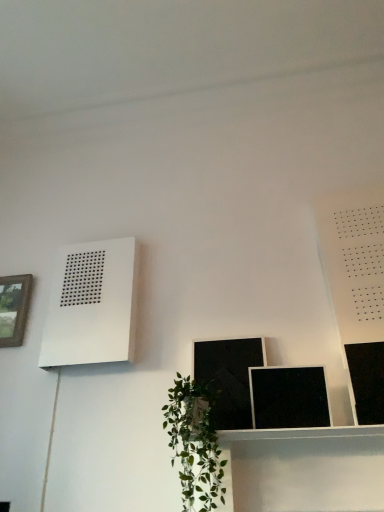
Question: Does black matte picture frame at lower center, which is counted as the 3th picture frame, starting from the left, lie in front of white matte air conditioner at upper left?

Choices:
 (A) no
 (B) yes

Answer: (B)

Question: Is white matte air conditioner at upper left completely or partially inside black matte picture frame at lower center, which is counted as the 3th picture frame, starting from the left?

Choices:
 (A) yes
 (B) no

Answer: (B)

Question: From a real-world perspective, does black matte picture frame at lower center, which is counted as the 3th picture frame, starting from the left, stand above white matte air conditioner at upper left?

Choices:
 (A) yes
 (B) no

Answer: (B)

Question: Is black matte picture frame at lower center, which is counted as the second picture frame, starting from the front, not near white matte air conditioner at upper left?

Choices:
 (A) no
 (B) yes

Answer: (A)

Question: Is black matte picture frame at lower center, which is counted as the 3th picture frame, starting from the left, facing towards white matte air conditioner at upper left?

Choices:
 (A) no
 (B) yes

Answer: (A)

Question: Considering the positions of matte black picture frame at lower center, which ranks as the second picture frame in left-to-right order, and green leafy plant at lower center in the image, is matte black picture frame at lower center, which ranks as the second picture frame in left-to-right order, wider or thinner than green leafy plant at lower center?

Choices:
 (A) wide
 (B) thin

Answer: (B)

Question: Is matte black picture frame at lower center, the third picture frame when ordered from right to left, inside the boundaries of green leafy plant at lower center, or outside?

Choices:
 (A) inside
 (B) outside

Answer: (B)

Question: From a real-world perspective, relative to green leafy plant at lower center, is matte black picture frame at lower center, the 2th picture frame viewed from the back, vertically above or below?

Choices:
 (A) above
 (B) below

Answer: (A)

Question: Is matte black picture frame at lower center, the 2th picture frame viewed from the back, taller or shorter than green leafy plant at lower center?

Choices:
 (A) tall
 (B) short

Answer: (B)

Question: Is point (274, 401) positioned closer to the camera than point (369, 421)?

Choices:
 (A) closer
 (B) farther

Answer: (B)

Question: Is black matte picture frame at lower center, placed as the 3th picture frame when sorted from back to front, to the left or to the right of black glossy picture frame at upper right, positioned as the first picture frame in right-to-left order, in the image?

Choices:
 (A) right
 (B) left

Answer: (B)

Question: From a real-world perspective, is black matte picture frame at lower center, which is counted as the 3th picture frame, starting from the left, positioned above or below black glossy picture frame at upper right, positioned as the first picture frame in right-to-left order?

Choices:
 (A) above
 (B) below

Answer: (B)

Question: Is black matte picture frame at lower center, the 2th picture frame when ordered from right to left, wider or thinner than black glossy picture frame at upper right, which is the fourth picture frame in left-to-right order?

Choices:
 (A) wide
 (B) thin

Answer: (A)

Question: From a real-world perspective, is matte black picture frame at lower center, acting as the third picture frame starting from the front, physically located above or below black glossy picture frame at upper right, which is the fourth picture frame in left-to-right order?

Choices:
 (A) below
 (B) above

Answer: (B)

Question: Is matte black picture frame at lower center, which ranks as the second picture frame in left-to-right order, inside the boundaries of black glossy picture frame at upper right, which ranks as the 4th picture frame in back-to-front order, or outside?

Choices:
 (A) outside
 (B) inside

Answer: (A)